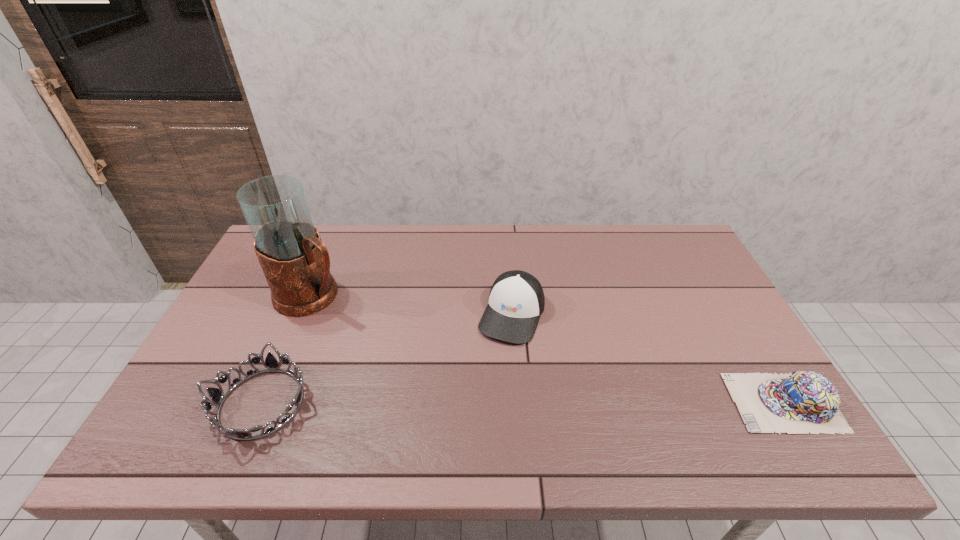
Where is `object present at the near left corner`? The height and width of the screenshot is (540, 960). object present at the near left corner is located at coordinates coord(217,396).

Where is `object that is positioned at the near right corner`? The height and width of the screenshot is (540, 960). object that is positioned at the near right corner is located at coordinates (800, 402).

The height and width of the screenshot is (540, 960). In the image, there is a desktop. Identify the location of vacant region at the far edge. 567,251.

Identify the location of vacant space at the near edge of the desktop. This screenshot has width=960, height=540. (565, 414).

Locate an element on the screen. Image resolution: width=960 pixels, height=540 pixels. free space at the left edge of the desktop is located at coordinates (198, 366).

Image resolution: width=960 pixels, height=540 pixels. In the image, there is a desktop. In order to click on free space at the right edge in this screenshot , I will do (686, 278).

Identify the location of free area in between the taller cap and the tiara. (387, 359).

The height and width of the screenshot is (540, 960). I want to click on free space between the taller cap and the nearer cap, so click(648, 359).

Identify the location of free space between the rightmost object and the tallest object. The image size is (960, 540). (548, 349).

I want to click on unoccupied area between the taller cap and the right cap, so click(x=648, y=359).